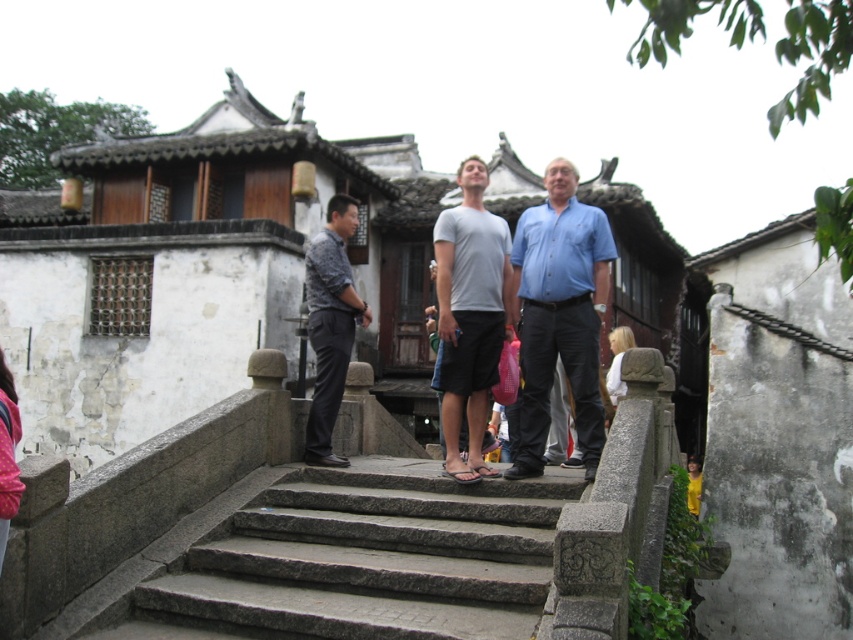
Is point (538, 365) farther from camera compared to point (347, 204)?

No, (538, 365) is in front of (347, 204).

Locate an element on the screen. This screenshot has height=640, width=853. blue cotton shirt at center is located at coordinates 560,314.

Where is `blue cotton shirt at center`? The height and width of the screenshot is (640, 853). blue cotton shirt at center is located at coordinates (560, 314).

Is blue cotton shirt at center positioned behind white cotton shirt at center?

No.

I want to click on blue cotton shirt at center, so click(560, 314).

Is point (340, 234) farther from camera compared to point (625, 333)?

That is False.

Does dark gray fabric shirt at center have a larger size compared to white cotton shirt at center?

Correct, dark gray fabric shirt at center is larger in size than white cotton shirt at center.

Which is behind, point (316, 433) or point (625, 330)?

The point (625, 330) is behind.

Image resolution: width=853 pixels, height=640 pixels. I want to click on dark gray fabric shirt at center, so click(329, 324).